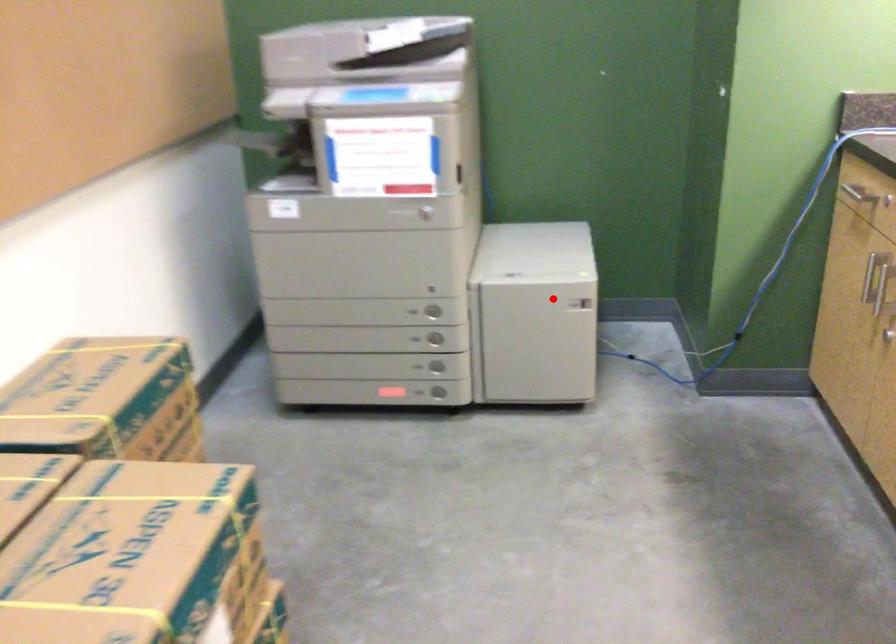
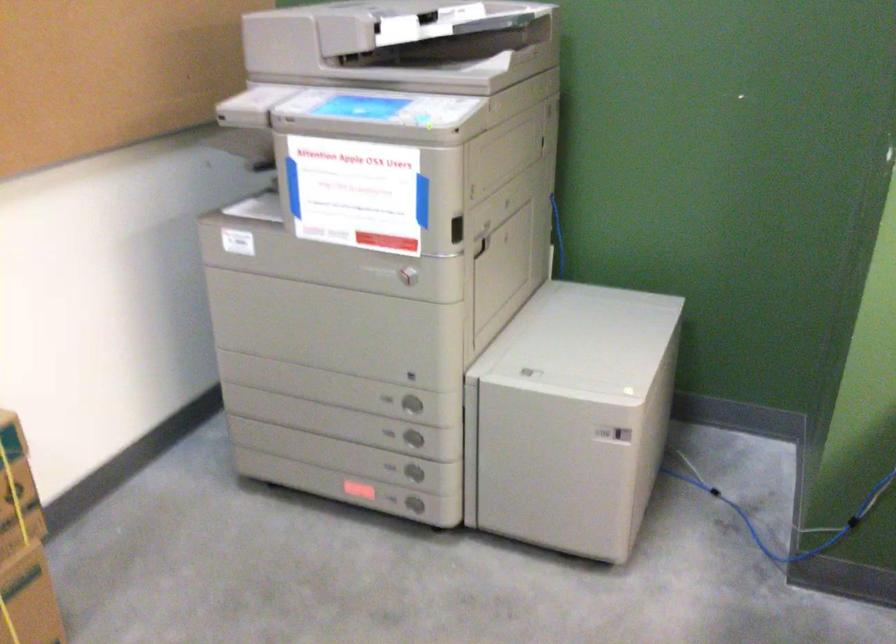
Question: I am providing you with two images of the same scene from different viewpoints. In image1, a red point is highlighted. Considering the same 3D point in image2, which of the following is correct?

Choices:
 (A) It is closer
 (B) It is farther

Answer: (A)